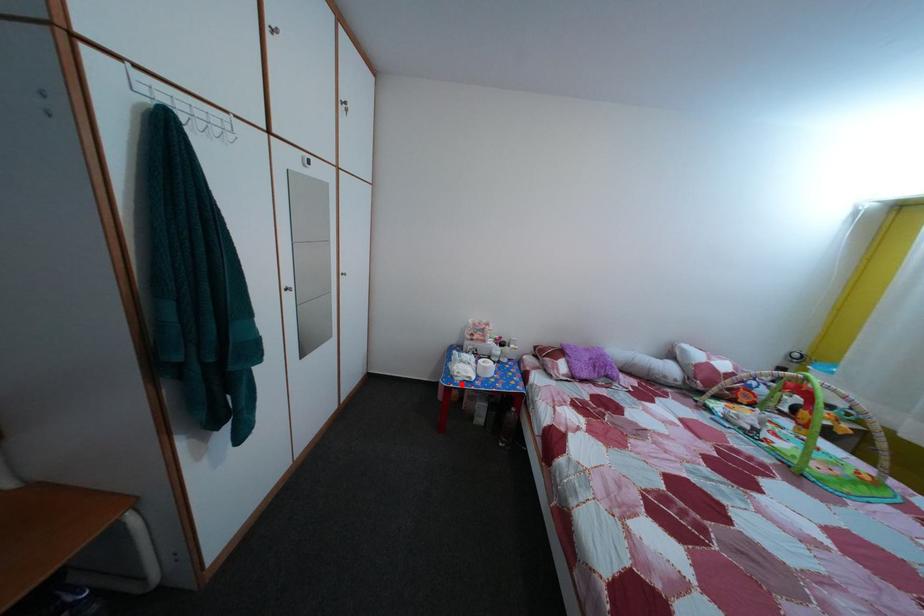
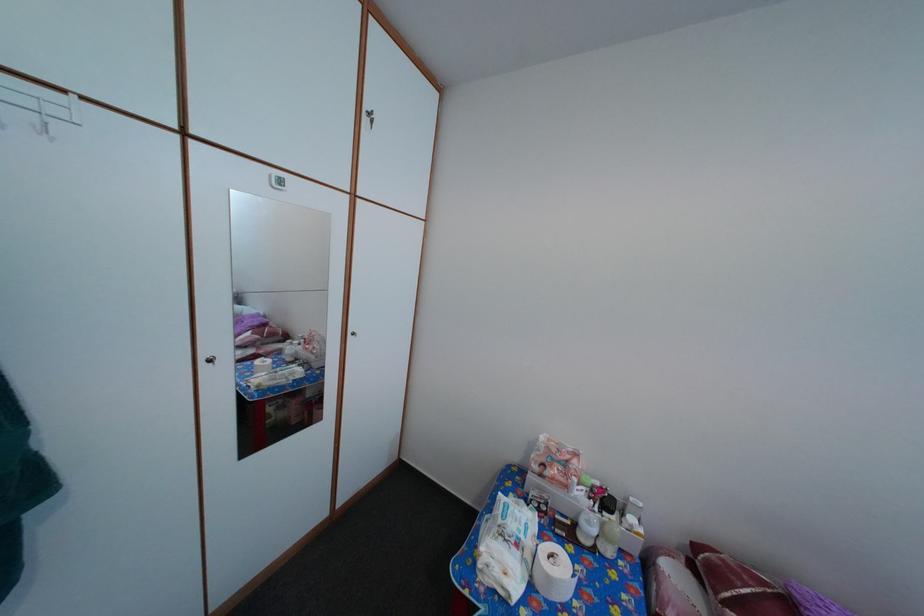
Question: I am providing you with two images of the same scene from different viewpoints. A red point is marked on the first image. At the location where the point appears in image 1, is it still visible in image 2?

Choices:
 (A) Yes
 (B) No

Answer: (A)